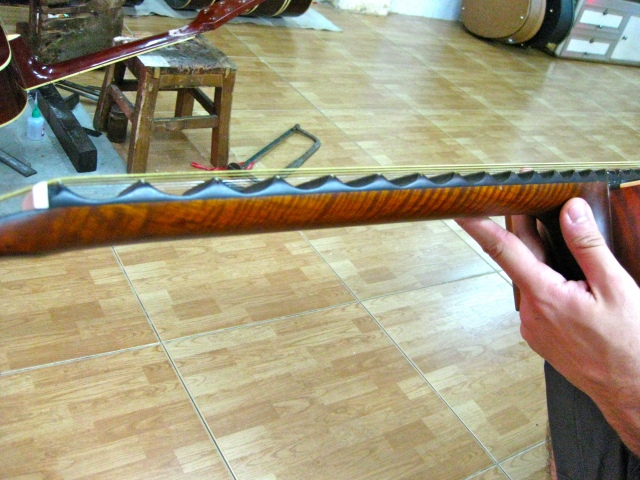
The image size is (640, 480). What are the coordinates of `stool` in the screenshot? It's located at click(x=214, y=63).